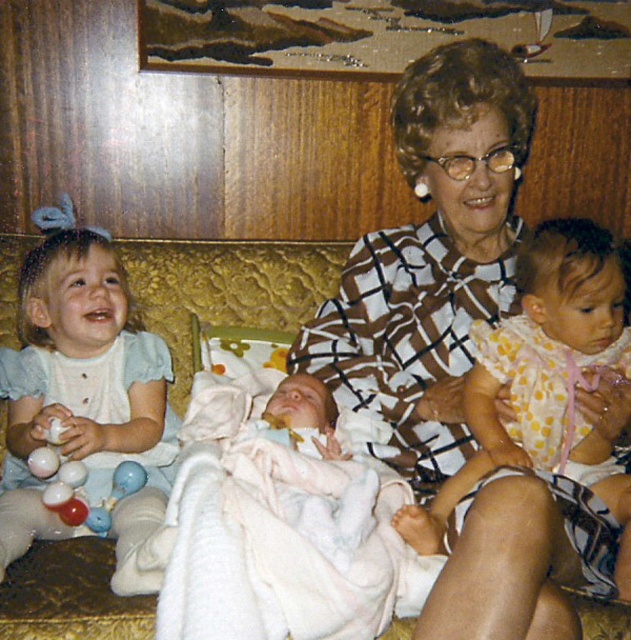
Does light blue fabric dress at left lie in front of gold textured couch at center?

Yes, light blue fabric dress at left is closer to the viewer.

Is point (162, 417) closer to viewer compared to point (283, 282)?

That is True.

The height and width of the screenshot is (640, 631). I want to click on light blue fabric dress at left, so click(x=85, y=401).

Who is shorter, light blue fabric dress at left or yellow polka dot dress at center?

With less height is yellow polka dot dress at center.

Is light blue fabric dress at left positioned behind yellow polka dot dress at center?

Yes, light blue fabric dress at left is behind yellow polka dot dress at center.

Who is more forward, [1,518] or [550,259]?

Point [550,259] is in front.

Image resolution: width=631 pixels, height=640 pixels. Identify the location of light blue fabric dress at left. (85, 401).

Between yellow polka dot dress at center and gold textured couch at center, which one is positioned higher?

Positioned higher is gold textured couch at center.

Is yellow polka dot dress at center smaller than gold textured couch at center?

Actually, yellow polka dot dress at center might be larger than gold textured couch at center.

Between point (606, 282) and point (158, 252), which one is positioned behind?

Positioned behind is point (158, 252).

Locate an element on the screen. This screenshot has height=640, width=631. yellow polka dot dress at center is located at coordinates (546, 380).